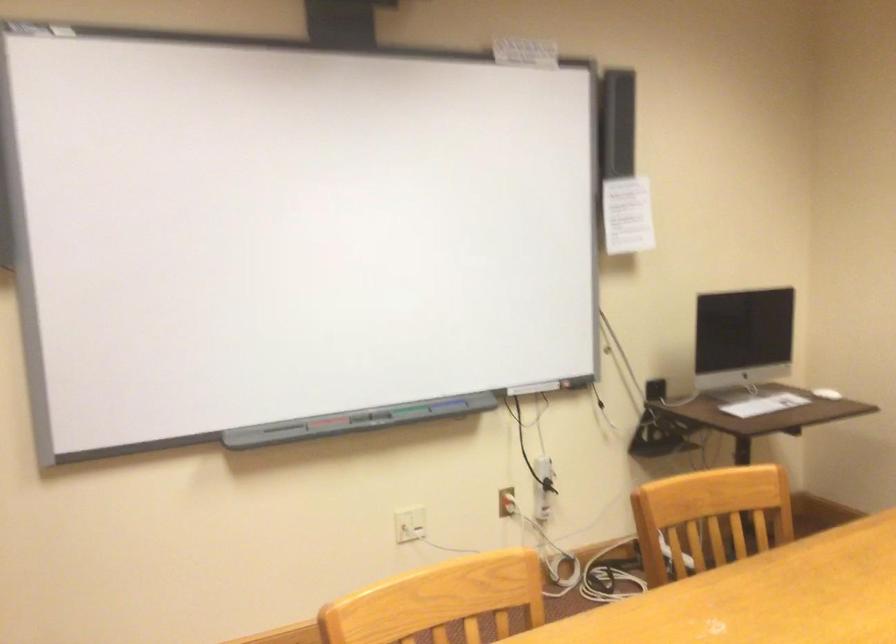
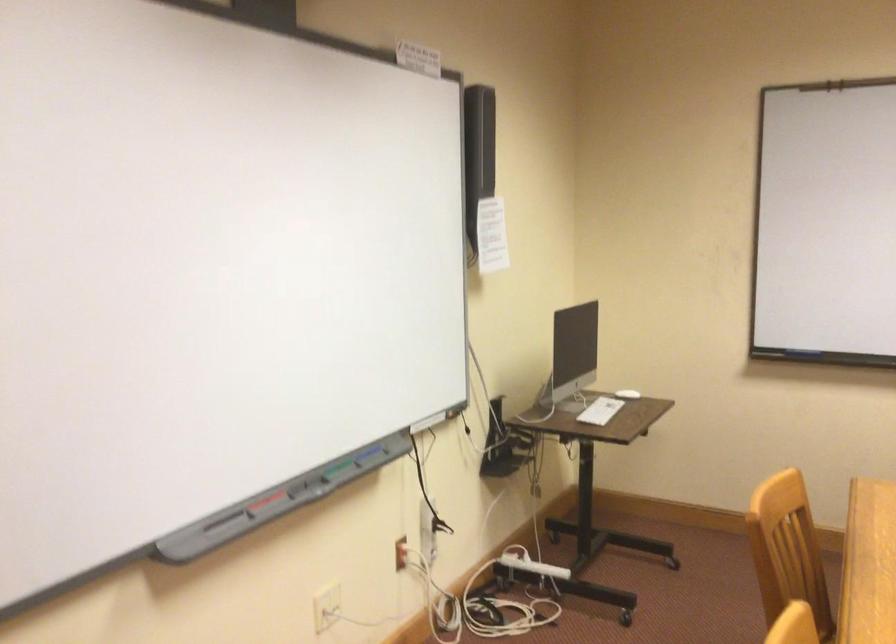
The point at (457, 404) is marked in the first image. Where is the corresponding point in the second image?

(368, 453)